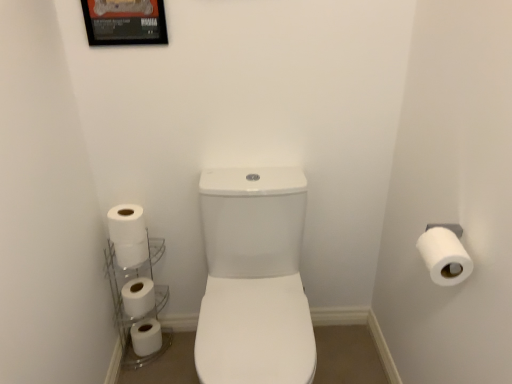
Describe the element at coordinates (254, 278) in the screenshot. I see `white glossy toilet at center` at that location.

The height and width of the screenshot is (384, 512). Identify the location of white glossy toilet at center. pos(254,278).

The image size is (512, 384). Describe the element at coordinates (146, 337) in the screenshot. I see `white matte toilet paper at lower left, which is the first toilet paper in back-to-front order` at that location.

This screenshot has width=512, height=384. What do you see at coordinates (128, 235) in the screenshot?
I see `white matte toilet paper at left, the 4th toilet paper positioned from the left` at bounding box center [128, 235].

I want to click on white matte toilet paper at left, the 1th toilet paper from the top, so click(128, 235).

The image size is (512, 384). What do you see at coordinates (123, 301) in the screenshot?
I see `clear glass shelves at lower left` at bounding box center [123, 301].

The height and width of the screenshot is (384, 512). I want to click on white matte toilet paper at right, the 4th toilet paper in the bottom-to-top sequence, so pos(444,256).

The height and width of the screenshot is (384, 512). What do you see at coordinates (444, 256) in the screenshot? I see `white matte toilet paper at right, the fifth toilet paper in the back-to-front sequence` at bounding box center [444, 256].

Image resolution: width=512 pixels, height=384 pixels. I want to click on white matte toilet paper at lower left, placed as the second toilet paper when sorted from left to right, so click(138, 297).

Identify the location of white glossy toilet at center. (254, 278).

The height and width of the screenshot is (384, 512). What are the coordinates of `toilet bowl below the metallic framed poster at upper left (from the image's perspective)` in the screenshot? It's located at [254, 278].

Who is bigger, white glossy toilet at center or metallic framed poster at upper left?

Bigger between the two is white glossy toilet at center.

From a real-world perspective, is white glossy toilet at center physically located above or below metallic framed poster at upper left?

white glossy toilet at center is situated lower than metallic framed poster at upper left in the real world.

Are metallic framed poster at upper left and white glossy toilet at center located far from each other?

No, metallic framed poster at upper left is in close proximity to white glossy toilet at center.

Is metallic framed poster at upper left situated inside white glossy toilet at center or outside?

metallic framed poster at upper left is outside white glossy toilet at center.

Does metallic framed poster at upper left appear on the left side of white glossy toilet at center?

Correct, you'll find metallic framed poster at upper left to the left of white glossy toilet at center.

Between point (127, 30) and point (293, 248), which one is positioned in front?

Positioned in front is point (127, 30).

Is white matte toilet paper at lower left, placed as the second toilet paper when sorted from left to right, placed right next to white matte toilet paper at right, the first toilet paper when ordered from front to back?

No, white matte toilet paper at lower left, placed as the second toilet paper when sorted from left to right, is not in contact with white matte toilet paper at right, the first toilet paper when ordered from front to back.

Which of these two, white matte toilet paper at lower left, positioned as the 4th toilet paper in top-to-bottom order, or white matte toilet paper at right, the 1th toilet paper from the right, stands taller?

Standing taller between the two is white matte toilet paper at lower left, positioned as the 4th toilet paper in top-to-bottom order.

How many degrees apart are the facing directions of white matte toilet paper at lower left, positioned as the 4th toilet paper in top-to-bottom order, and white matte toilet paper at right, marked as the second toilet paper in a top-to-bottom arrangement?

They differ by 89.2 degrees in their facing directions.

Which toilet paper is the 3rd one when counting from the back of the white matte toilet paper at right, the 1th toilet paper from the right? Please provide its 2D coordinates.

[(138, 297)]

Is white matte toilet paper at left, the third toilet paper from the front, far away from white glossy toilet at center?

white matte toilet paper at left, the third toilet paper from the front, is actually quite close to white glossy toilet at center.

Would you say white matte toilet paper at left, acting as the 3th toilet paper starting from the right, is outside white glossy toilet at center?

Yes, white matte toilet paper at left, acting as the 3th toilet paper starting from the right, is located beyond the bounds of white glossy toilet at center.

You are a GUI agent. You are given a task and a screenshot of the screen. Output one action in this format:
    pyautogui.click(x=<x>, y=<y>)
    Task: Click on the toilet bowl below the white matte toilet paper at left, acting as the 3th toilet paper starting from the right (from a real-world perspective)
    
    Given the screenshot: What is the action you would take?
    pyautogui.click(x=254, y=278)

Looking at the image, does white matte toilet paper at left, which is counted as the 3th toilet paper, starting from the back, seem bigger or smaller compared to white glossy toilet at center?

Clearly, white matte toilet paper at left, which is counted as the 3th toilet paper, starting from the back, is smaller in size than white glossy toilet at center.

Considering the points (460, 262) and (157, 40), which point is behind, point (460, 262) or point (157, 40)?

Positioned behind is point (157, 40).

Is white matte toilet paper at right, the 1th toilet paper from the right, thinner than metallic framed poster at upper left?

Incorrect, the width of white matte toilet paper at right, the 1th toilet paper from the right, is not less than that of metallic framed poster at upper left.

From a real-world perspective, relative to metallic framed poster at upper left, is white matte toilet paper at right, the 4th toilet paper in the bottom-to-top sequence, vertically above or below?

Clearly, from a real-world perspective, white matte toilet paper at right, the 4th toilet paper in the bottom-to-top sequence, is below metallic framed poster at upper left.

Is white matte toilet paper at right, marked as the second toilet paper in a top-to-bottom arrangement, positioned before metallic framed poster at upper left?

Yes, white matte toilet paper at right, marked as the second toilet paper in a top-to-bottom arrangement, is closer to the viewer.

Could white matte toilet paper at right, the 1th toilet paper from the right, be considered to be inside white glossy toilet at center?

No, white matte toilet paper at right, the 1th toilet paper from the right, is located outside of white glossy toilet at center.

Considering the relative sizes of white glossy toilet at center and white matte toilet paper at right, the 1th toilet paper from the right, in the image provided, is white glossy toilet at center bigger than white matte toilet paper at right, the 1th toilet paper from the right,?

Yes.

Would you say white glossy toilet at center is to the left or to the right of white matte toilet paper at right, the 4th toilet paper in the bottom-to-top sequence, in the picture?

white glossy toilet at center is to the left of white matte toilet paper at right, the 4th toilet paper in the bottom-to-top sequence.

Is white glossy toilet at center looking in the opposite direction of white matte toilet paper at right, the 4th toilet paper in the bottom-to-top sequence?

white glossy toilet at center does not have its back to white matte toilet paper at right, the 4th toilet paper in the bottom-to-top sequence.

The image size is (512, 384). Identify the location of the 2nd toilet paper directly beneath the white matte toilet paper at right, arranged as the 5th toilet paper when viewed from the left (from a real-world perspective). (132, 253).

Does white matte toilet paper at left, placed as the third toilet paper when sorted from top to bottom, appear on the left side of white matte toilet paper at right, the 4th toilet paper in the bottom-to-top sequence?

Yes.

Looking at their sizes, would you say white matte toilet paper at left, marked as the 3th toilet paper in a bottom-to-top arrangement, is wider or thinner than white matte toilet paper at right, the 4th toilet paper in the bottom-to-top sequence?

white matte toilet paper at left, marked as the 3th toilet paper in a bottom-to-top arrangement, is thinner than white matte toilet paper at right, the 4th toilet paper in the bottom-to-top sequence.

You are a GUI agent. You are given a task and a screenshot of the screen. Output one action in this format:
    pyautogui.click(x=<x>, y=<y>)
    Task: Click on the picture frame on the left of white glossy toilet at center
    
    Given the screenshot: What is the action you would take?
    point(125,22)

The image size is (512, 384). I want to click on picture frame behind the white glossy toilet at center, so click(125, 22).

Based on the photo, which object lies nearer to the anchor point white glossy toilet at center, white matte toilet paper at lower left, which is the first toilet paper in back-to-front order, or clear glass shelves at lower left?

clear glass shelves at lower left is closer to white glossy toilet at center.

Based on their spatial positions, is white matte toilet paper at lower left, the fifth toilet paper viewed from the top, or white matte toilet paper at left, the 4th toilet paper positioned from the left, closer to white matte toilet paper at lower left, positioned as the 4th toilet paper in top-to-bottom order?

white matte toilet paper at lower left, the fifth toilet paper viewed from the top, is positioned closer to the anchor white matte toilet paper at lower left, positioned as the 4th toilet paper in top-to-bottom order.

From the image, which object appears to be farther from white matte toilet paper at left, acting as the second toilet paper starting from the right, metallic framed poster at upper left or white glossy toilet at center?

metallic framed poster at upper left is positioned further to the anchor white matte toilet paper at left, acting as the second toilet paper starting from the right.

Estimate the real-world distances between objects in this image. Which object is further from white matte toilet paper at lower left, marked as the 5th toilet paper in a right-to-left arrangement, metallic framed poster at upper left or clear glass shelves at lower left?

metallic framed poster at upper left.

Considering their positions, is white matte toilet paper at left, acting as the second toilet paper starting from the right, positioned closer to metallic framed poster at upper left than white matte toilet paper at left, which is counted as the 3th toilet paper, starting from the back?

white matte toilet paper at left, acting as the second toilet paper starting from the right, is closer to metallic framed poster at upper left.

Which object lies further to the anchor point white matte toilet paper at left, placed as the third toilet paper when sorted from top to bottom, white matte toilet paper at lower left, the 2th toilet paper in the bottom-to-top sequence, or white glossy toilet at center?

white glossy toilet at center.

When comparing their distances from white matte toilet paper at right, the 4th toilet paper in the bottom-to-top sequence, does white matte toilet paper at left, marked as the second toilet paper in a front-to-back arrangement, or white matte toilet paper at left, the third toilet paper from the front, seem further?

Based on the image, white matte toilet paper at left, the third toilet paper from the front, appears to be further to white matte toilet paper at right, the 4th toilet paper in the bottom-to-top sequence.

Which object lies nearer to the anchor point white matte toilet paper at left, acting as the second toilet paper starting from the right, clear glass shelves at lower left or white matte toilet paper at left, acting as the 3th toilet paper starting from the right?

white matte toilet paper at left, acting as the 3th toilet paper starting from the right.

Where is `toilet bowl between metallic framed poster at upper left and clear glass shelves at lower left in the up-down direction`? Image resolution: width=512 pixels, height=384 pixels. toilet bowl between metallic framed poster at upper left and clear glass shelves at lower left in the up-down direction is located at coordinates (254, 278).

Where is `shelf between white glossy toilet at center and white matte toilet paper at lower left, marked as the 5th toilet paper in a right-to-left arrangement, from front to back`? This screenshot has height=384, width=512. shelf between white glossy toilet at center and white matte toilet paper at lower left, marked as the 5th toilet paper in a right-to-left arrangement, from front to back is located at coordinates (123, 301).

In order to click on shelf between metallic framed poster at upper left and white matte toilet paper at lower left, which is the first toilet paper in back-to-front order, vertically in this screenshot , I will do (x=123, y=301).

At what (x,y) coordinates should I click in order to perform the action: click on picture frame between white matte toilet paper at left, placed as the third toilet paper when sorted from top to bottom, and white matte toilet paper at right, the first toilet paper when ordered from front to back, in the horizontal direction. Please return your answer as a coordinate pair (x, y). Image resolution: width=512 pixels, height=384 pixels. Looking at the image, I should click on (125, 22).